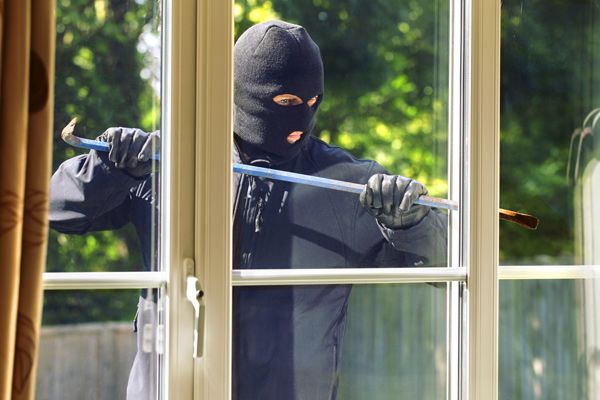
Find the location of a particular element. This screenshot has height=400, width=600. window is located at coordinates (140, 242), (298, 242), (524, 234).